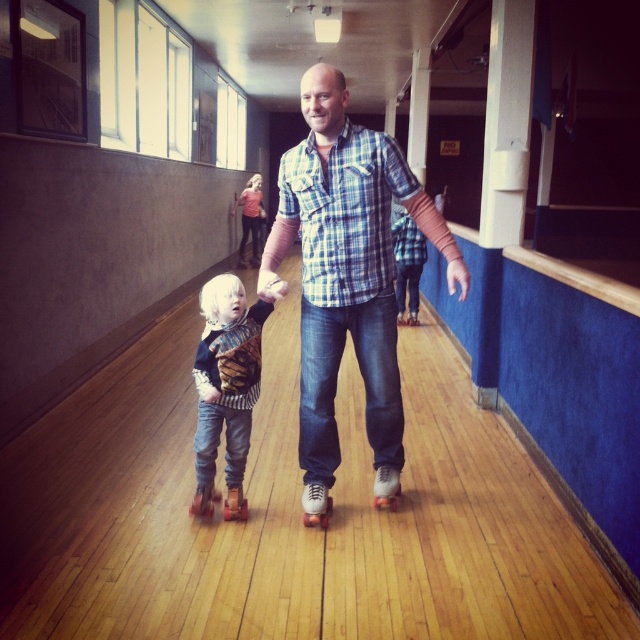
Question: Which object is positioned farthest from the white rubber roller skate at center?

Choices:
 (A) white matte roller skate at center
 (B) blue plaid shirt at center

Answer: (B)

Question: Considering the relative positions of orange matte roller skate at lower left and rubber/smooth roller skate at lower center in the image provided, where is orange matte roller skate at lower left located with respect to rubber/smooth roller skate at lower center?

Choices:
 (A) left
 (B) right

Answer: (A)

Question: Which of the following is the farthest from the observer?

Choices:
 (A) (211, 488)
 (B) (225, 500)
 (C) (387, 502)

Answer: (C)

Question: Does blue plaid shirt at center have a larger size compared to flannel shirt at center?

Choices:
 (A) yes
 (B) no

Answer: (A)

Question: Which point is farther from the camera taking this photo?

Choices:
 (A) tap(192, 504)
 (B) tap(234, 404)
 (C) tap(321, 520)
 (D) tap(308, 218)

Answer: (A)

Question: Is white rubber roller skate at center to the right of white matte roller skate at center from the viewer's perspective?

Choices:
 (A) yes
 (B) no

Answer: (B)